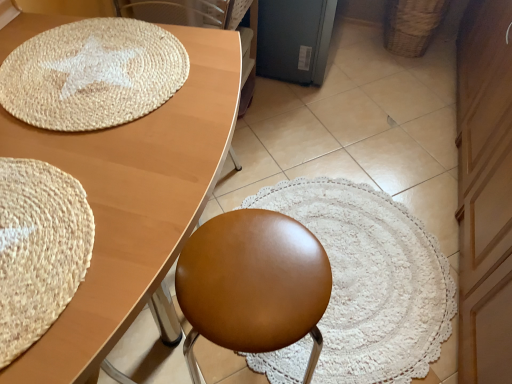
Question: Does satin brown stool at center lie in front of matte wood table at upper left?

Choices:
 (A) yes
 (B) no

Answer: (B)

Question: Is satin brown stool at center far from matte wood table at upper left?

Choices:
 (A) yes
 (B) no

Answer: (B)

Question: Could matte wood table at upper left be considered to be inside satin brown stool at center?

Choices:
 (A) no
 (B) yes

Answer: (A)

Question: From a real-world perspective, does satin brown stool at center stand above matte wood table at upper left?

Choices:
 (A) yes
 (B) no

Answer: (B)

Question: Is satin brown stool at center not within matte wood table at upper left?

Choices:
 (A) no
 (B) yes

Answer: (A)

Question: From the image's perspective, is satin brown stool at center on top of matte wood table at upper left?

Choices:
 (A) no
 (B) yes

Answer: (A)

Question: Is woven brown basket at upper right positioned in front of matte wood table at upper left?

Choices:
 (A) no
 (B) yes

Answer: (A)

Question: Is woven brown basket at upper right positioned beyond the bounds of matte wood table at upper left?

Choices:
 (A) yes
 (B) no

Answer: (A)

Question: Is the surface of woven brown basket at upper right in direct contact with matte wood table at upper left?

Choices:
 (A) no
 (B) yes

Answer: (A)

Question: Could you tell me if woven brown basket at upper right is turned towards matte wood table at upper left?

Choices:
 (A) yes
 (B) no

Answer: (A)

Question: Does woven brown basket at upper right have a lesser height compared to matte wood table at upper left?

Choices:
 (A) no
 (B) yes

Answer: (B)

Question: Is woven brown basket at upper right further to camera compared to matte wood table at upper left?

Choices:
 (A) yes
 (B) no

Answer: (A)

Question: Considering the relative sizes of brown leather swivel chair at upper center and natural fiber mat at upper left, the first mat when ordered from back to front, in the image provided, is brown leather swivel chair at upper center wider than natural fiber mat at upper left, the first mat when ordered from back to front,?

Choices:
 (A) no
 (B) yes

Answer: (A)